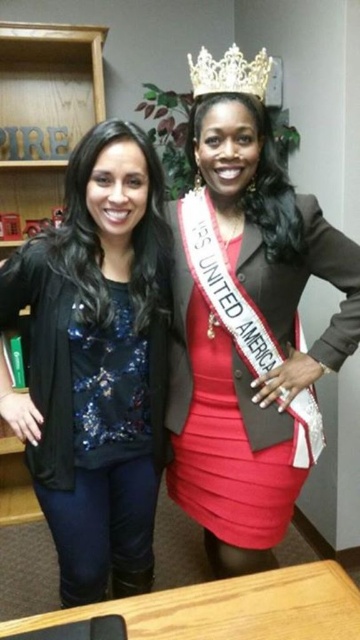
Question: Estimate the real-world distances between objects in this image. Which object is farther from the satin red dress at center?

Choices:
 (A) sequined fabric top at center
 (B) gold metallic crown at upper center

Answer: (B)

Question: Which object is positioned farthest from the gold metallic crown at upper center?

Choices:
 (A) sequined fabric top at center
 (B) satin red dress at center

Answer: (A)

Question: From the image, what is the correct spatial relationship of wooden bookshelf at left in relation to gold metallic crown at upper center?

Choices:
 (A) above
 (B) below

Answer: (B)

Question: Does wooden bookshelf at left have a smaller size compared to gold metallic crown at upper center?

Choices:
 (A) yes
 (B) no

Answer: (B)

Question: Which point is farther to the camera?

Choices:
 (A) sequined fabric top at center
 (B) gold metallic crown at upper center

Answer: (B)

Question: Where is sequined fabric top at center located in relation to wooden bookshelf at left in the image?

Choices:
 (A) above
 (B) below

Answer: (B)